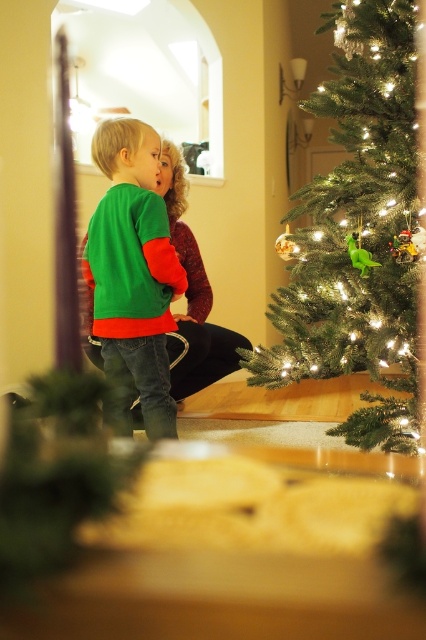
You are a photographer setting up a shot in this scene. You need to ensure that both the green matte christmas tree at right and the green matte sweater at center are in focus. Given their sizes, which object should you adjust your camera focus on first to ensure proper framing?

The green matte christmas tree at right is taller than the green matte sweater at center, so you should focus on the taller tree first to ensure it fits within the frame before adjusting for the smaller sweater.

You are planning to place a new decoration on the green matte sweater at center. Considering the green matte christmas tree at right is wider than the sweater, will the decoration fit if it is the same size as the sweater?

The green matte christmas tree at right is wider than the green matte sweater at center, so the decoration designed for the sweater will fit under the tree since the tree is wider.

Looking at this image, you are organizing a holiday photo shoot and need to ensure that the green matte Christmas tree at right and the green matte sweater at center are both visible in the frame. Given their sizes, which object should be placed closer to the camera to maintain their visibility?

The green matte Christmas tree at right is larger in size than the green matte sweater at center, so to maintain visibility of both, the green matte sweater at center should be placed closer to the camera since it is smaller and might otherwise get lost against the larger tree.